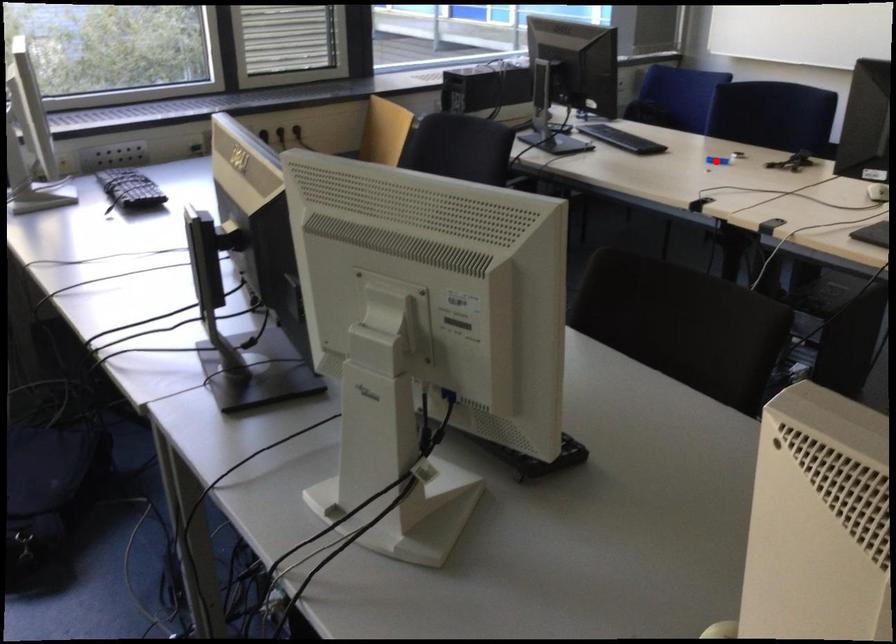
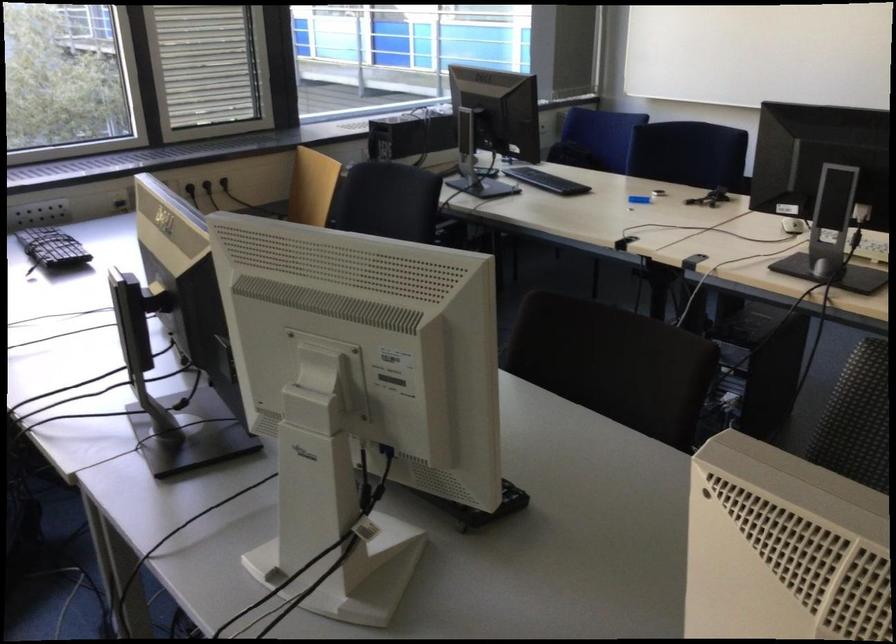
Find the pixel in the second image that matches the highlighted location in the first image.

(640, 200)